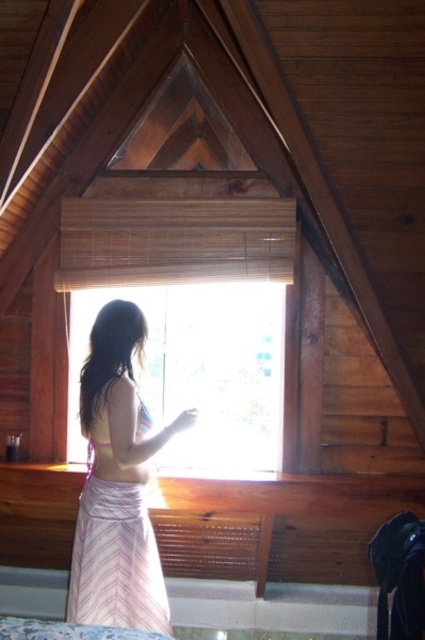
Who is more distant from viewer, (251, 401) or (127, 369)?

Point (251, 401)

Can you confirm if transparent glass window at center is positioned to the right of pink striped skirt at center?

Yes, transparent glass window at center is to the right of pink striped skirt at center.

Is point (206, 321) behind point (99, 346)?

Yes, it is.

The height and width of the screenshot is (640, 425). What are the coordinates of `transparent glass window at center` in the screenshot? It's located at (200, 369).